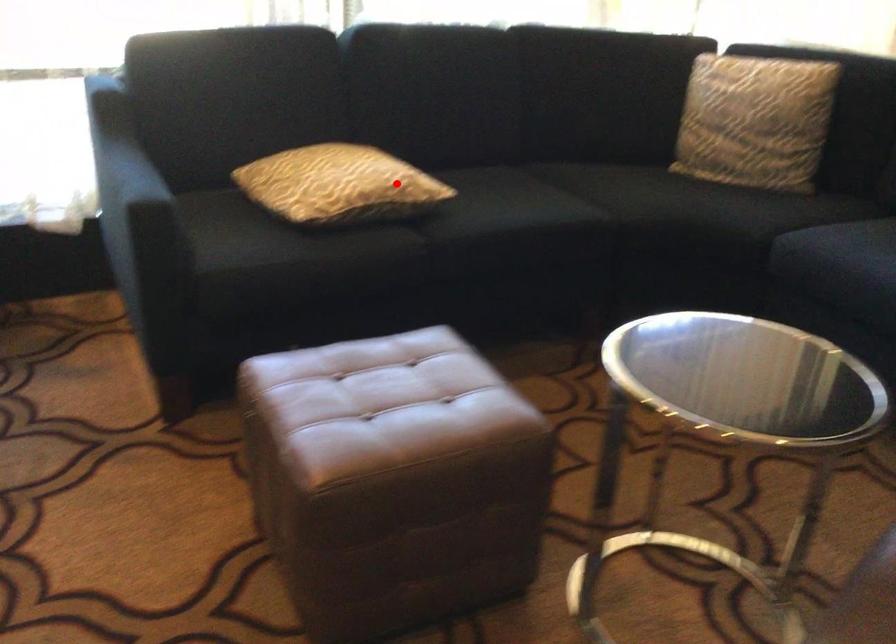
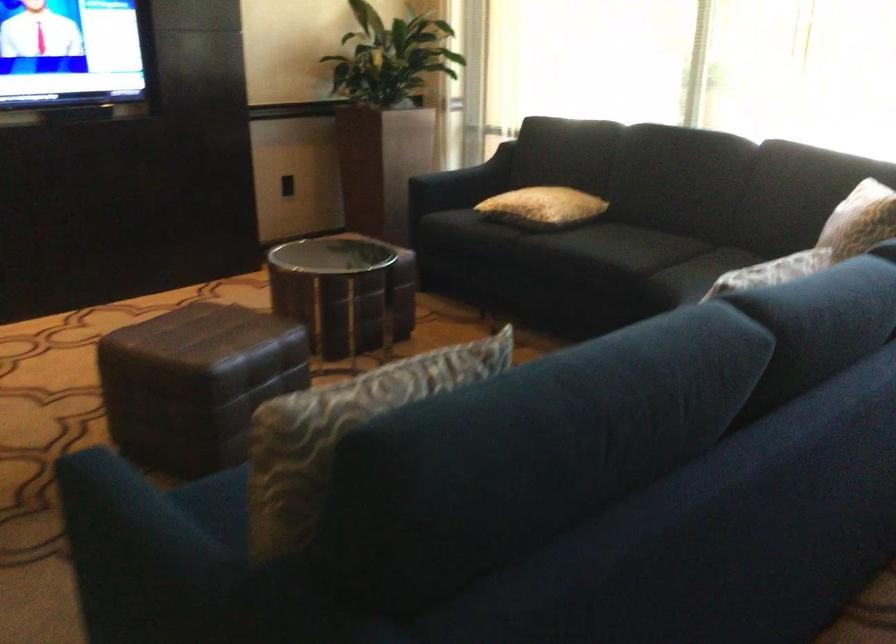
Find the pixel in the second image that matches the highlighted location in the first image.

(543, 207)